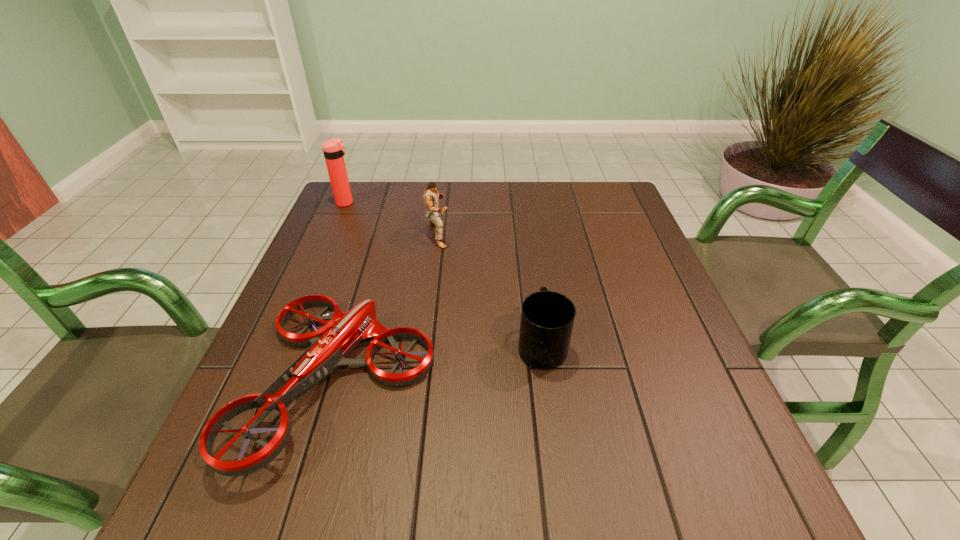
Locate an element on the screen. This screenshot has height=540, width=960. the farthest object is located at coordinates (333, 149).

Identify the location of thermos bottle. (333, 149).

Where is `the third shortest object`? the third shortest object is located at coordinates (434, 213).

Find the location of a particular element. The image size is (960, 540). the second farthest object is located at coordinates (434, 213).

At what (x,y) coordinates should I click in order to perform the action: click on the rightmost object. Please return your answer as a coordinate pair (x, y). This screenshot has width=960, height=540. Looking at the image, I should click on (547, 317).

You are a GUI agent. You are given a task and a screenshot of the screen. Output one action in this format:
    pyautogui.click(x=<x>, y=<y>)
    Task: Click on the mug
    This screenshot has height=540, width=960.
    Given the screenshot: What is the action you would take?
    pyautogui.click(x=547, y=317)

Find the location of a particular element. the shortest object is located at coordinates (330, 345).

Find the location of a particular element. The image size is (960, 540). free space located 0.340m on the right of the farthest object is located at coordinates (468, 203).

The width and height of the screenshot is (960, 540). What are the coordinates of `free location located on the front-facing side of the second tallest object` in the screenshot? It's located at pos(577,235).

The width and height of the screenshot is (960, 540). I want to click on free space located on the side of the mug with the handle, so click(x=526, y=232).